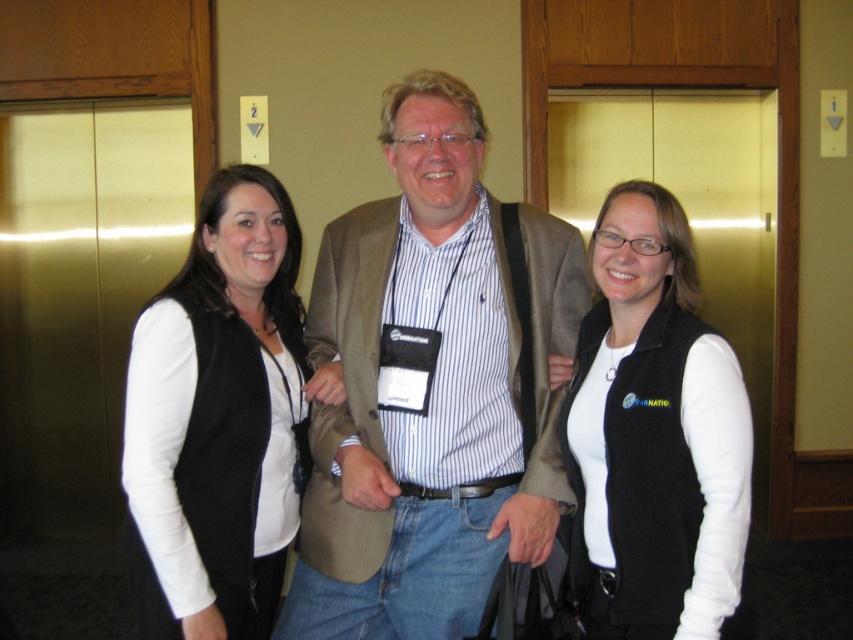
Image resolution: width=853 pixels, height=640 pixels. What do you see at coordinates (219, 419) in the screenshot? I see `black fleece vest at left` at bounding box center [219, 419].

Is black fleece vest at left above black fleece vest at right?

Indeed, black fleece vest at left is positioned over black fleece vest at right.

Is point (136, 444) positioned after point (714, 560)?

Yes, it is.

What are the coordinates of `black fleece vest at left` in the screenshot? It's located at (219, 419).

Is point (312, 284) farther from viewer compared to point (691, 566)?

Yes, point (312, 284) is farther from viewer.

Is striped cotton shirt at center to the left of black fleece vest at right from the viewer's perspective?

Correct, you'll find striped cotton shirt at center to the left of black fleece vest at right.

Is point (456, 436) positioned after point (630, 502)?

That is True.

This screenshot has width=853, height=640. I want to click on striped cotton shirt at center, so click(x=432, y=387).

Which is more to the right, striped cotton shirt at center or black fleece vest at left?

striped cotton shirt at center

Is striped cotton shirt at center smaller than black fleece vest at left?

No, striped cotton shirt at center is not smaller than black fleece vest at left.

The width and height of the screenshot is (853, 640). I want to click on striped cotton shirt at center, so click(x=432, y=387).